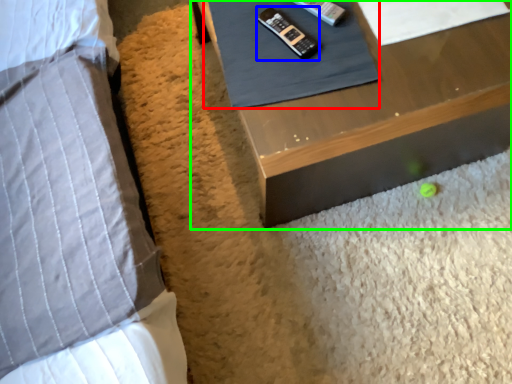
Question: Considering the real-world distances, which object is farthest from sheet (highlighted by a red box)? control (highlighted by a blue box) or table (highlighted by a green box)?

Choices:
 (A) control
 (B) table

Answer: (B)